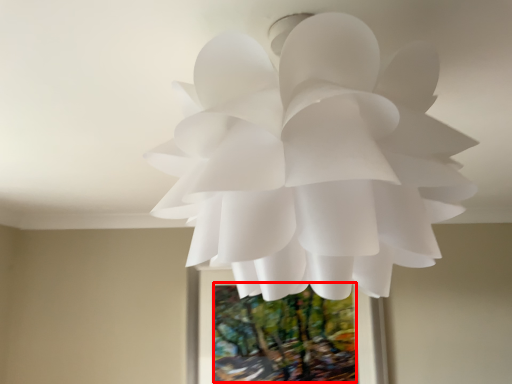
Question: From the image's perspective, considering the relative positions of tree (annotated by the red box) and flower in the image provided, where is tree (annotated by the red box) located with respect to the staircase?

Choices:
 (A) above
 (B) below

Answer: (B)